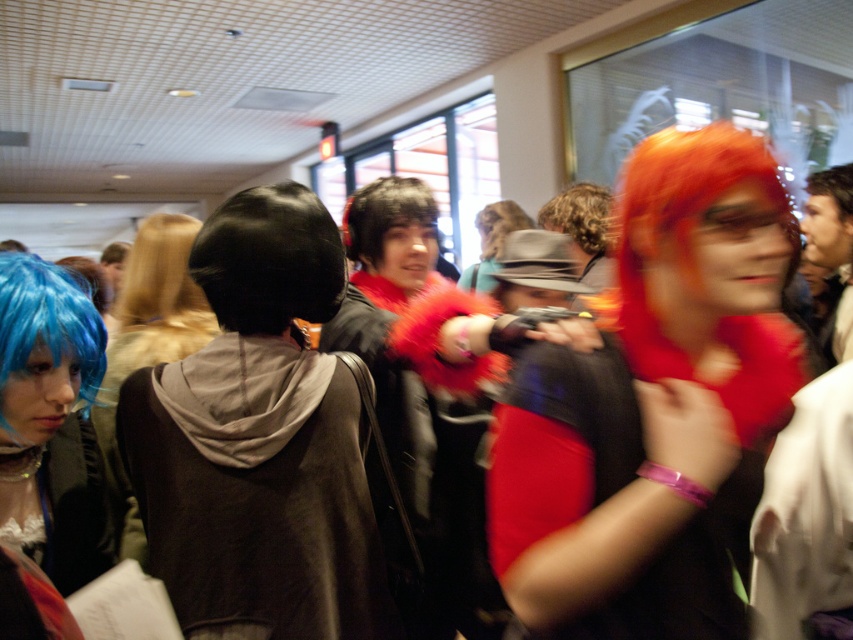
Question: Can you confirm if shiny orange wig at center is smaller than matte black hoodie at center?

Choices:
 (A) no
 (B) yes

Answer: (B)

Question: Which point is closer to the camera taking this photo?

Choices:
 (A) (579, 374)
 (B) (141, 253)
 (C) (209, 602)
 (D) (96, 305)

Answer: (A)

Question: Is the position of black velvet hoodie at center less distant than that of matte black hoodie at center?

Choices:
 (A) no
 (B) yes

Answer: (B)

Question: Which point is farther to the camera?

Choices:
 (A) (483, 243)
 (B) (218, 316)

Answer: (A)

Question: Is black velvet hoodie at center behind blue wig at left?

Choices:
 (A) no
 (B) yes

Answer: (A)

Question: Which is nearer to the blue matte wig at left?

Choices:
 (A) curly brown hair at center
 (B) shiny brown hair at center

Answer: (A)